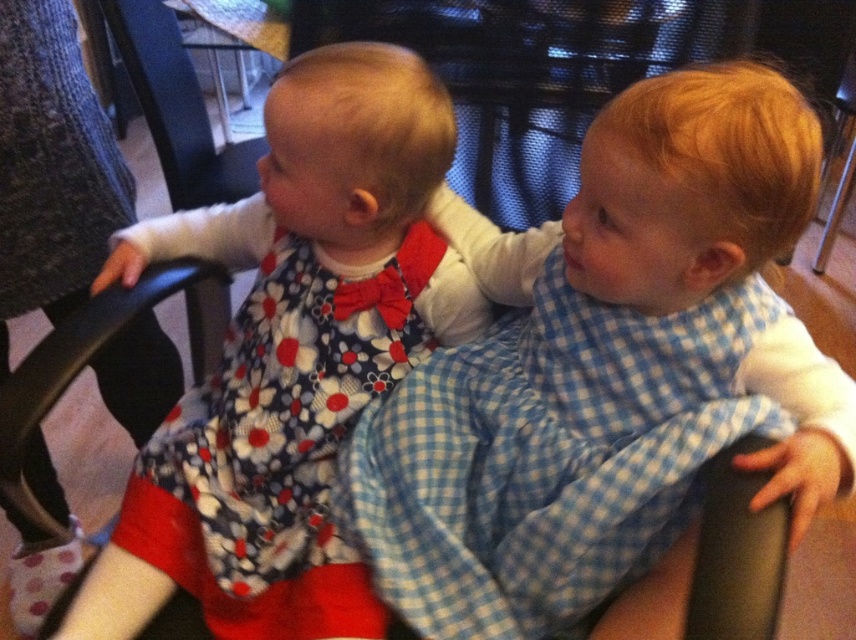
Between blue checkered bib at center and floral fabric dress at left, which one is positioned lower?

floral fabric dress at left is lower down.

Is blue checkered bib at center smaller than floral fabric dress at left?

No.

Identify the location of blue checkered bib at center. The image size is (856, 640). (605, 369).